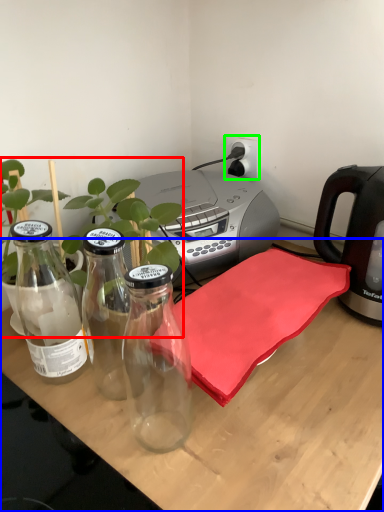
Question: Which object is positioned closest to plant (highlighted by a red box)? Select from desk (highlighted by a blue box) and electric outlet (highlighted by a green box).

Choices:
 (A) desk
 (B) electric outlet

Answer: (A)